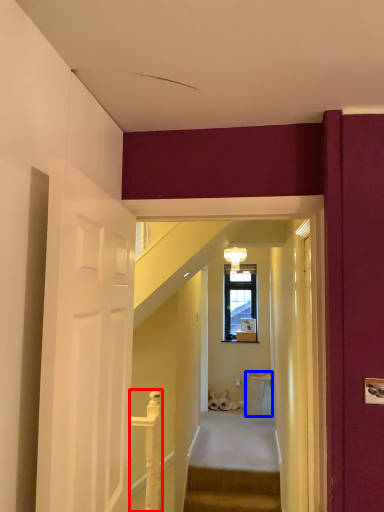
Question: Which point is further to the camera, balustrade (highlighted by a red box) or trash bin/can (highlighted by a blue box)?

Choices:
 (A) balustrade
 (B) trash bin/can

Answer: (B)